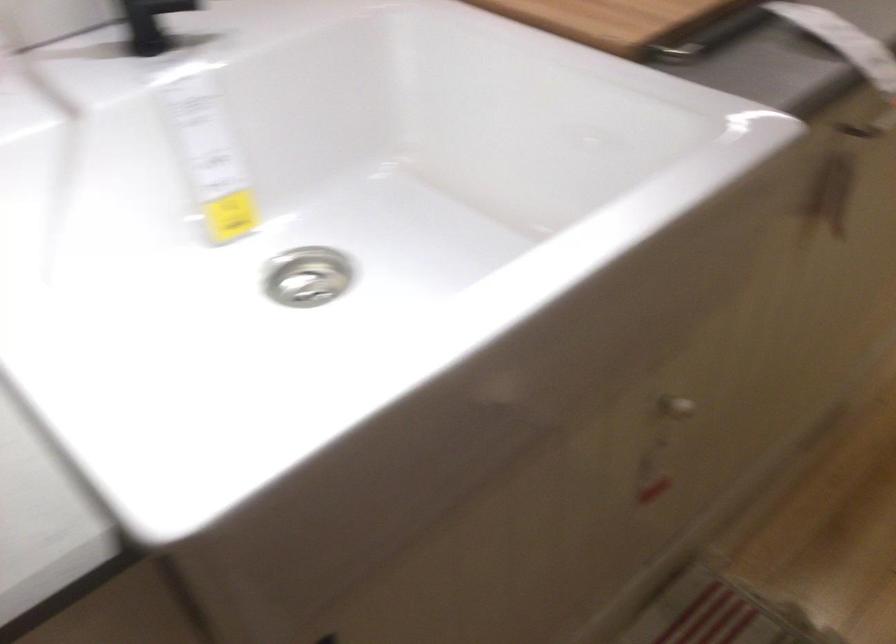
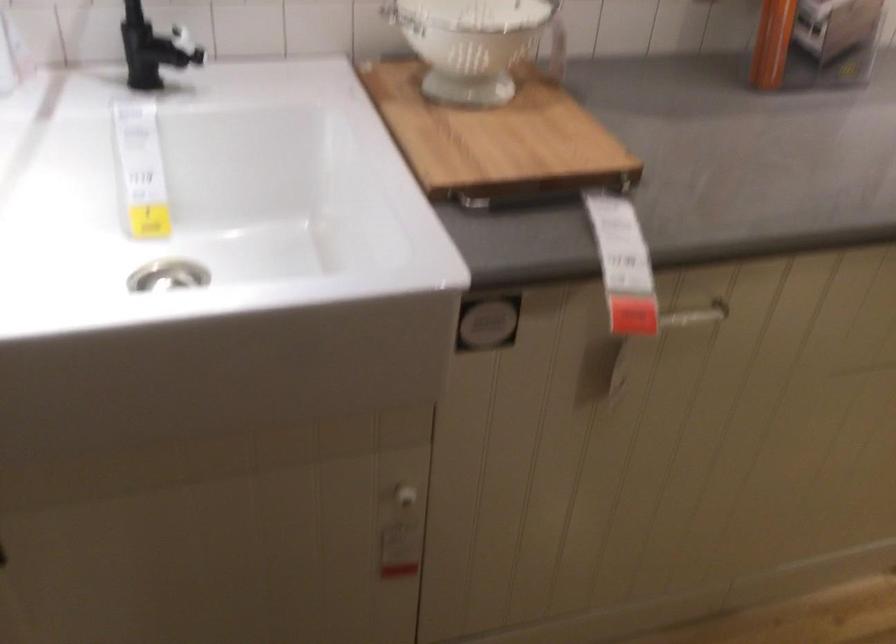
Locate, in the second image, the point that corresponds to point (677, 412) in the first image.

(403, 497)